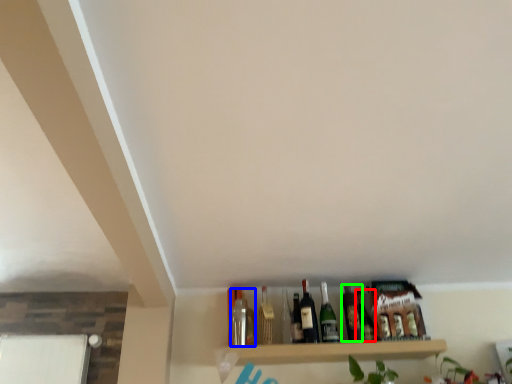
Question: Based on their relative distances, which object is nearer to bottle (highlighted by a red box)? Choose from bottle (highlighted by a blue box) and beer bottle (highlighted by a green box).

Choices:
 (A) bottle
 (B) beer bottle

Answer: (B)